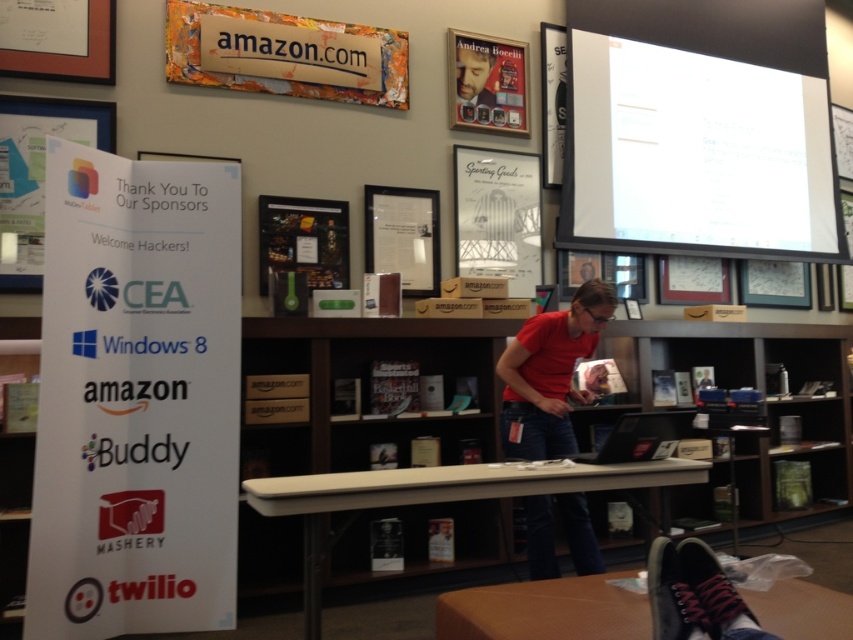
Question: Which point is closer to the camera?

Choices:
 (A) (410, 484)
 (B) (720, 225)
 (C) (468, 92)
 (D) (520, 273)

Answer: (A)

Question: Which object appears farthest from the camera in this image?

Choices:
 (A) white paper at left
 (B) brown wood table at lower center

Answer: (A)

Question: Can you confirm if white paper at left is positioned to the left of beige plastic table at center?

Choices:
 (A) no
 (B) yes

Answer: (B)

Question: Which object is farther from the camera taking this photo?

Choices:
 (A) matte white poster at upper center
 (B) painted wood sign at upper center
 (C) white glossy projector screen at upper right

Answer: (C)

Question: Can you confirm if matte white poster at upper center is positioned above matte black laptop at center?

Choices:
 (A) no
 (B) yes

Answer: (A)

Question: Does painted wood sign at upper center have a larger size compared to matte white poster at upper center?

Choices:
 (A) yes
 (B) no

Answer: (A)